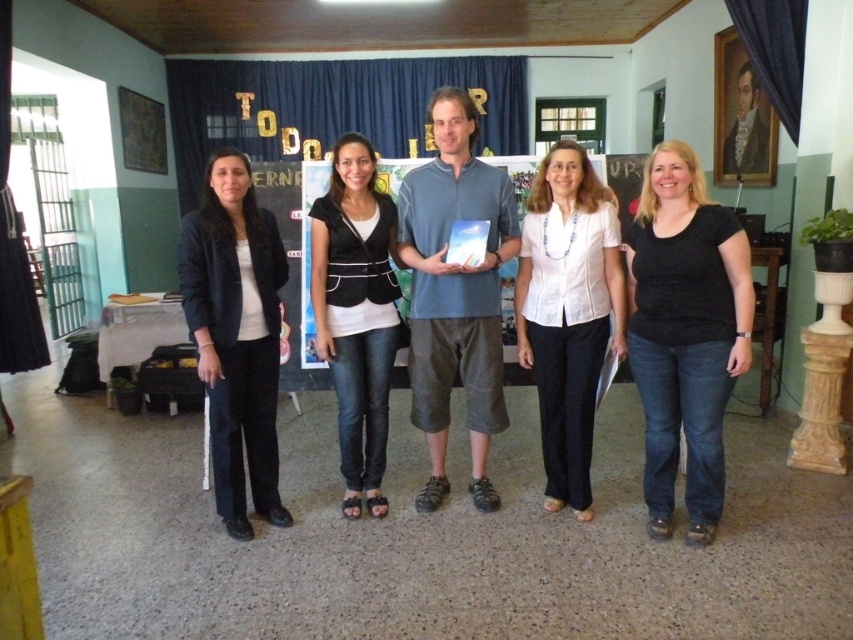
You are a photographer at the event and need to arrange the two individuals wearing the black matte shirt at center and the matte black blazer at left so that their clothing items are aligned with the venue layout. Given their current positions, which clothing item is to the right of the other?

The black matte shirt at center is positioned on the right side of the matte black blazer at left, so the black matte shirt at center is to the right of the matte black blazer at left.